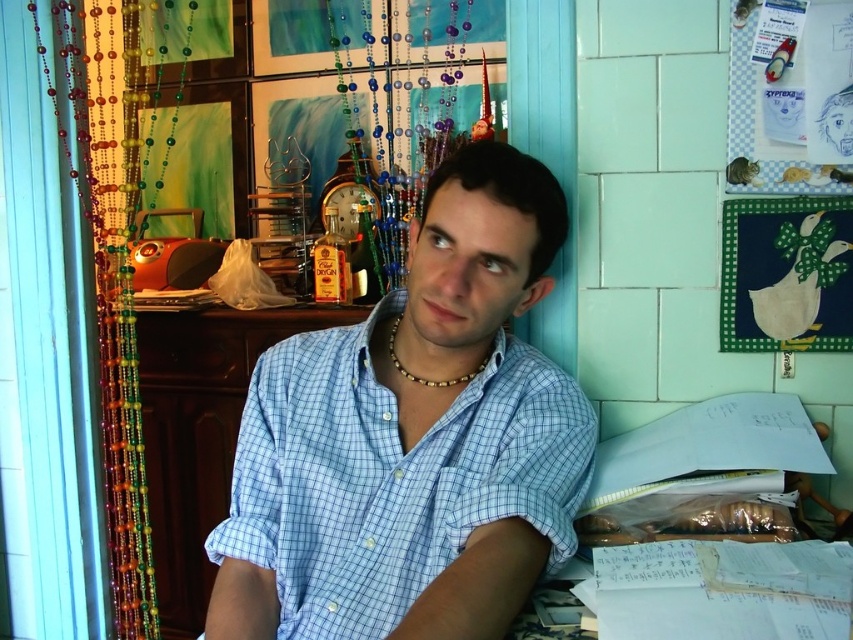
How much distance is there between green fabric quilt at upper right and gold metallic necklace at center?

green fabric quilt at upper right is 55.79 centimeters away from gold metallic necklace at center.

Is green fabric quilt at upper right positioned before gold metallic necklace at center?

No, it is not.

Locate an element on the screen. The height and width of the screenshot is (640, 853). green fabric quilt at upper right is located at coordinates (786, 275).

Is wooden at center taller than gold metallic necklace at center?

Yes, wooden at center is taller than gold metallic necklace at center.

Can you confirm if wooden at center is bigger than gold metallic necklace at center?

Correct, wooden at center is larger in size than gold metallic necklace at center.

Is point (160, 422) positioned behind point (409, 378)?

Yes.

Where is `wooden at center`? The image size is (853, 640). wooden at center is located at coordinates (200, 433).

Which is in front, point (544, 458) or point (395, 321)?

Point (544, 458) is more forward.

Is blue checkered shirt at center positioned behind gold metallic necklace at center?

No, blue checkered shirt at center is in front of gold metallic necklace at center.

Between point (392, 433) and point (397, 324), which one is positioned in front?

Point (392, 433) is in front.

The height and width of the screenshot is (640, 853). Identify the location of blue checkered shirt at center. (413, 438).